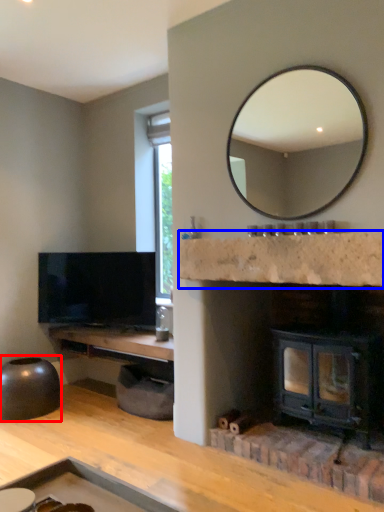
Question: Which object appears farthest to the camera in this image, round table (highlighted by a red box) or counter top (highlighted by a blue box)?

Choices:
 (A) round table
 (B) counter top

Answer: (A)